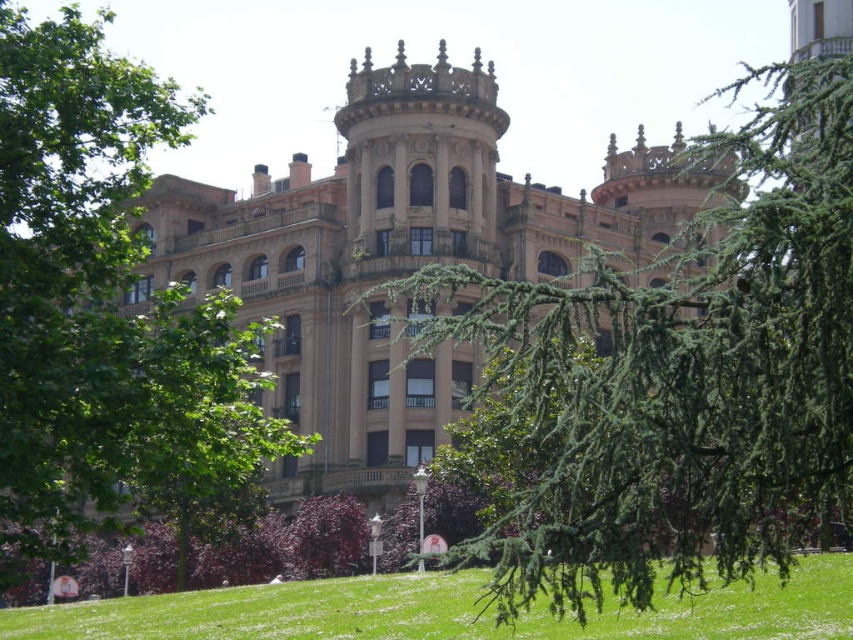
Question: Estimate the real-world distances between objects in this image. Which object is closer to the green grassy at lower center?

Choices:
 (A) brown stone palace at center
 (B) green needle-like branches at center
 (C) purple leafy tree at center
 (D) green leafy tree at left

Answer: (C)

Question: Where is green grassy at lower center located in relation to purple leafy tree at center in the image?

Choices:
 (A) left
 (B) right

Answer: (B)

Question: Considering the real-world distances, which object is closest to the green grassy at lower center?

Choices:
 (A) purple leafy tree at center
 (B) green leafy tree at left

Answer: (A)

Question: Which object appears farthest from the camera in this image?

Choices:
 (A) purple leafy tree at center
 (B) green needle-like branches at center

Answer: (A)

Question: Is green needle-like branches at center thinner than purple leafy tree at center?

Choices:
 (A) yes
 (B) no

Answer: (B)

Question: Considering the relative positions of green leafy tree at left and green grassy at lower center in the image provided, where is green leafy tree at left located with respect to green grassy at lower center?

Choices:
 (A) above
 (B) below

Answer: (A)